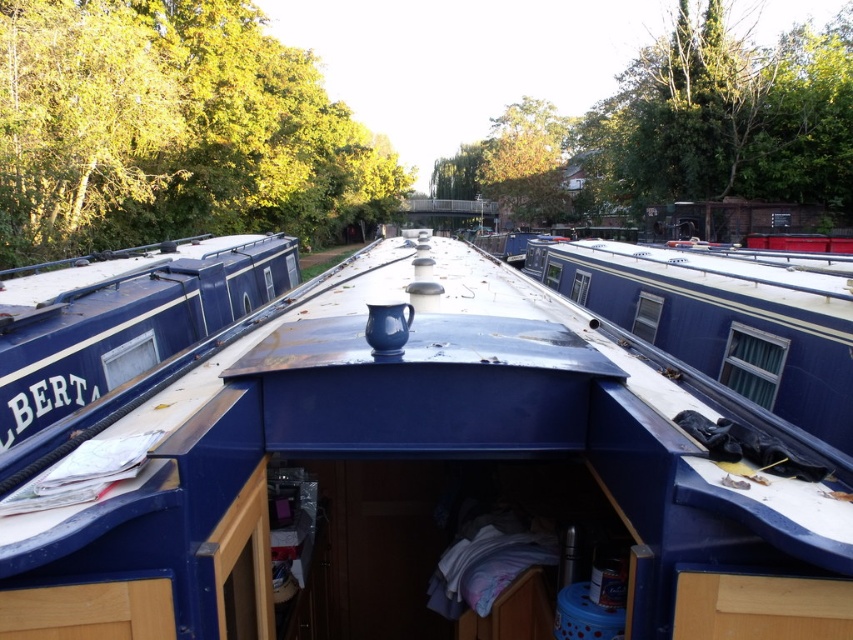
You are inside the boat and want to grab the glossy ceramic mug at upper center. Which direction should you move relative to the blue painted wood barge at left?

The glossy ceramic mug at upper center is to the right of the blue painted wood barge at left, so you should move to the right side of the blue painted wood barge at left to grab it.

You are a passenger on the boat named BERT. You want to reach the glossy ceramic mug at upper center from your current position. The boat is only 1.09 meters wide. Can you stretch your arm to grab it without moving your body?

The glossy ceramic mug at upper center is 1.09 meters away from your current position. Since the boat is 1.09 meters wide, you can just barely stretch your arm to reach it without moving your body.